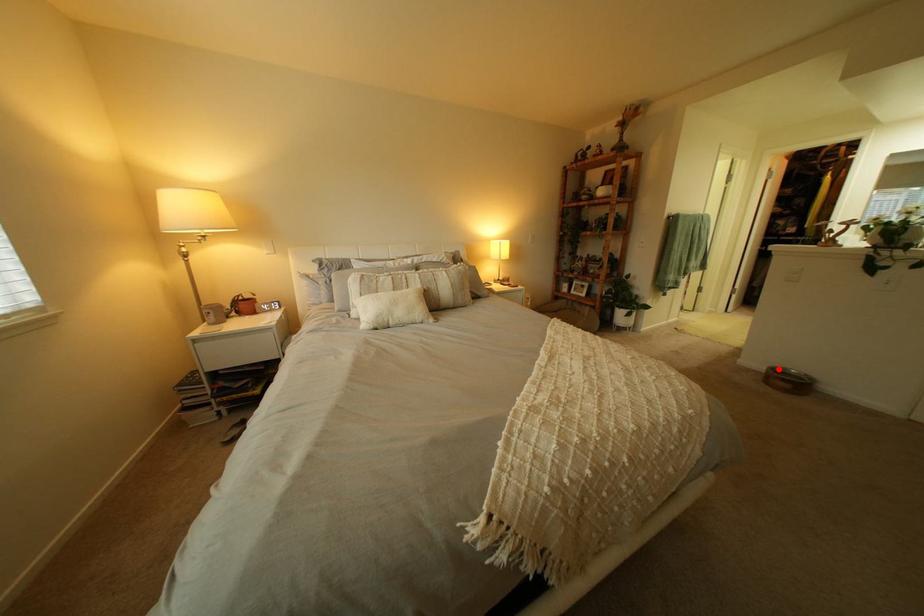
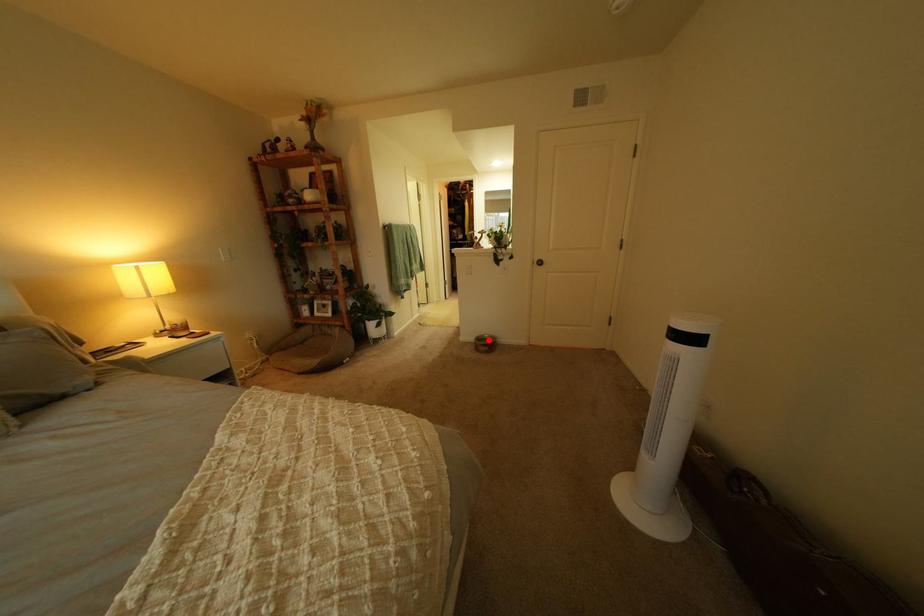
I am providing you with two images of the same scene from different viewpoints. A red point is marked on the first image and another point is marked on the second image. Does the point marked in image1 correspond to the same location as the one in image2?

Yes